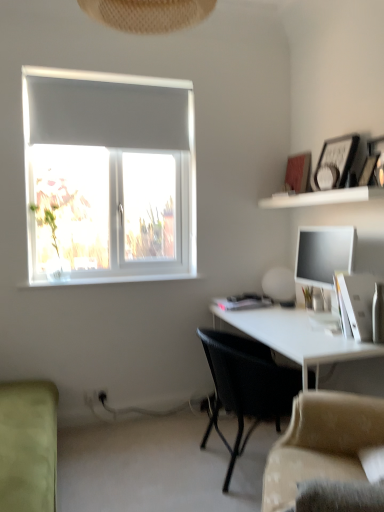
Question: Is beige fabric couch at lower right, which ranks as the 2th studio couch in left-to-right order, spatially inside white glossy desk at lower right, or outside of it?

Choices:
 (A) outside
 (B) inside

Answer: (A)

Question: Visually, is beige fabric couch at lower right, arranged as the first studio couch when viewed from the right, positioned to the left or to the right of white glossy desk at lower right?

Choices:
 (A) left
 (B) right

Answer: (A)

Question: Which object is the closest to the light green fabric couch at lower left, which is the first studio couch from left to right?

Choices:
 (A) satin black monitor at right
 (B) white glossy table lamp at upper right
 (C) beige fabric couch at lower right, which ranks as the 2th studio couch in left-to-right order
 (D) wooden picture frame at upper right
 (E) white glossy shelf at upper right

Answer: (C)

Question: Which of these objects is positioned closest to the satin black monitor at right?

Choices:
 (A) black woven chair at center
 (B) white glossy desk at lower right
 (C) light green fabric couch at lower left, which is the 2th studio couch in right-to-left order
 (D) beige fabric couch at lower right, arranged as the first studio couch when viewed from the right
 (E) wooden picture frame at upper right

Answer: (E)